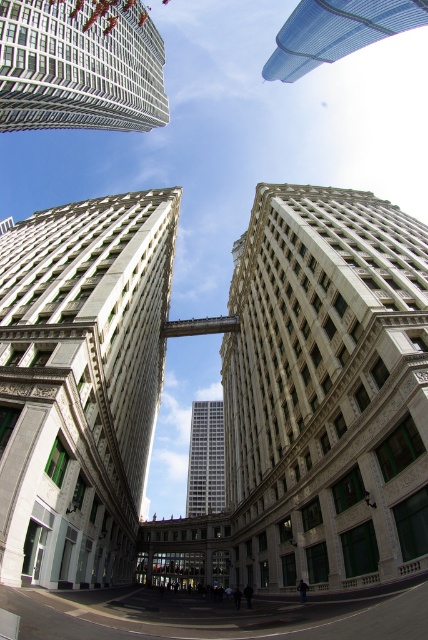
Question: Can you confirm if white stone building at center is bigger than white marble building at center?

Choices:
 (A) no
 (B) yes

Answer: (B)

Question: Is white marble building at center further to camera compared to transparent glass skyscraper at upper center?

Choices:
 (A) yes
 (B) no

Answer: (B)

Question: Is transparent glass skyscraper at upper center in front of white glass tower at center?

Choices:
 (A) yes
 (B) no

Answer: (A)

Question: Which of the following is the farthest from the observer?

Choices:
 (A) (306, 429)
 (B) (344, 35)
 (C) (223, 493)

Answer: (C)

Question: Which object is closer to the camera taking this photo?

Choices:
 (A) white stone building at center
 (B) white glass tower at center
 (C) white marble building at center
 (D) white glass skyscraper at upper left

Answer: (C)

Question: Considering the real-world distances, which object is closest to the white stone building at center?

Choices:
 (A) white marble building at center
 (B) transparent glass skyscraper at upper center
 (C) white glass tower at center

Answer: (A)